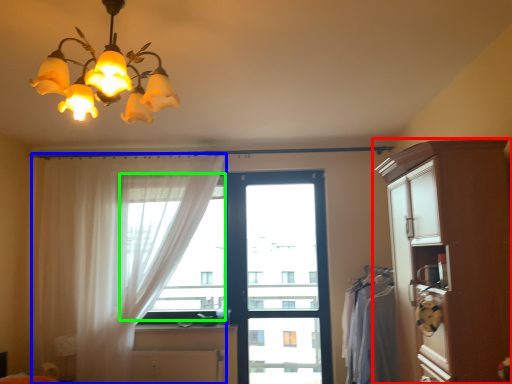
Question: Which object is positioned farthest from cabinetry (highlighted by a red box)? Select from curtain (highlighted by a blue box) and window screen (highlighted by a green box).

Choices:
 (A) curtain
 (B) window screen

Answer: (A)